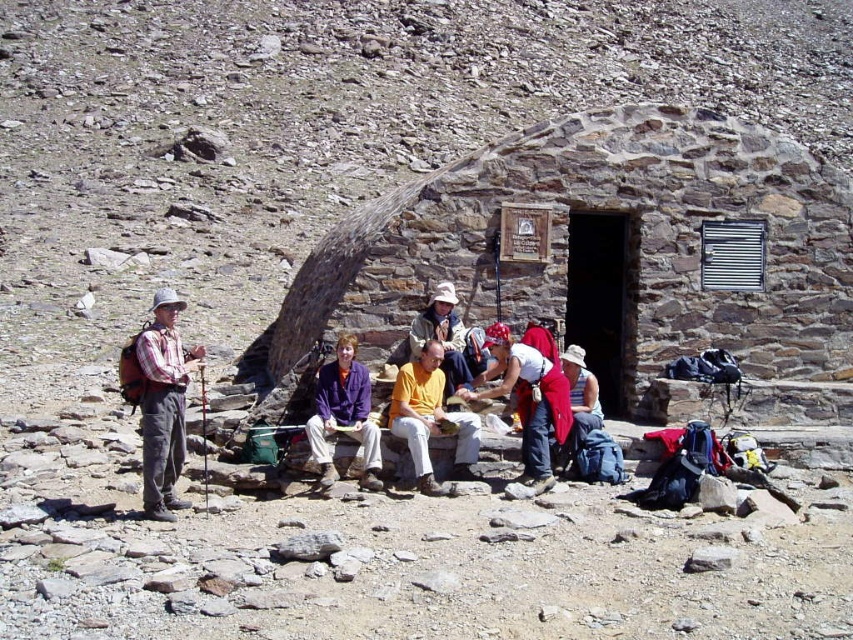
Can you confirm if yellow matte shirt at center is positioned to the left of matte yellow shirt at center?

Indeed, yellow matte shirt at center is positioned on the left side of matte yellow shirt at center.

Who is more forward, (397,380) or (459,333)?

Positioned in front is point (397,380).

What do you see at coordinates (431, 420) in the screenshot?
I see `yellow matte shirt at center` at bounding box center [431, 420].

Image resolution: width=853 pixels, height=640 pixels. I want to click on yellow matte shirt at center, so click(x=431, y=420).

Is red fabric shirt at center taller than yellow matte shirt at center?

In fact, red fabric shirt at center may be shorter than yellow matte shirt at center.

Can you confirm if red fabric shirt at center is positioned above yellow matte shirt at center?

Indeed, red fabric shirt at center is positioned over yellow matte shirt at center.

Does point (521, 387) come behind point (415, 426)?

Yes, point (521, 387) is farther from viewer.

Identify the location of red fabric shirt at center. (529, 397).

Does plaid cotton shirt at left lie in front of yellow matte shirt at center?

Yes.

What do you see at coordinates (163, 403) in the screenshot? This screenshot has width=853, height=640. I see `plaid cotton shirt at left` at bounding box center [163, 403].

Between point (154, 452) and point (426, 346), which one is positioned in front?

Point (154, 452) is more forward.

This screenshot has height=640, width=853. I want to click on plaid cotton shirt at left, so click(x=163, y=403).